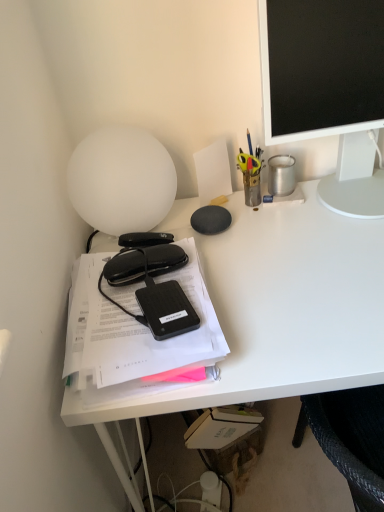
Where is `vacant space situated on the left part of metallic pen holder at upper right, the second stationery from the front`? The image size is (384, 512). vacant space situated on the left part of metallic pen holder at upper right, the second stationery from the front is located at coordinates (189, 218).